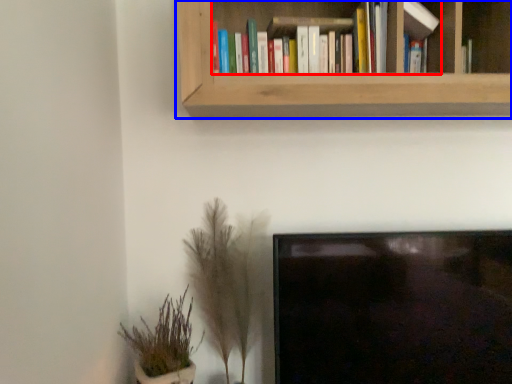
Question: Among these objects, which one is nearest to the camera, book (highlighted by a red box) or bookcase (highlighted by a blue box)?

Choices:
 (A) book
 (B) bookcase

Answer: (B)